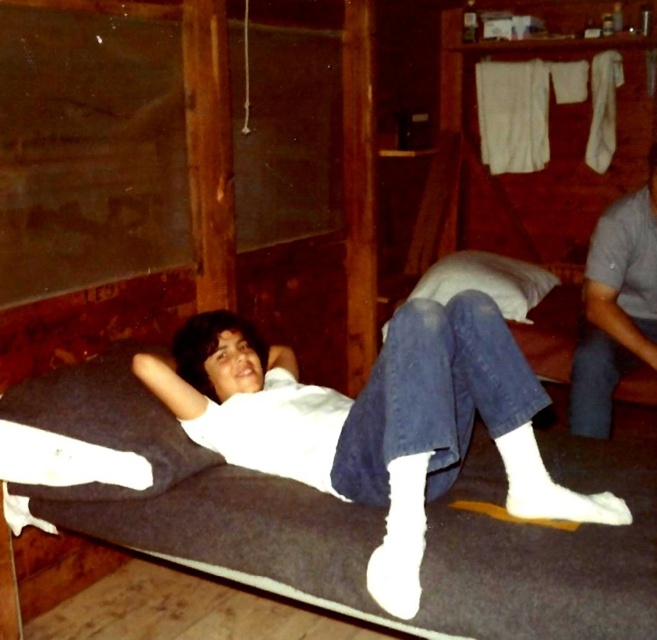
Does gray cotton shirt at right have a smaller size compared to white soft pillow at center?

Yes, gray cotton shirt at right is smaller than white soft pillow at center.

Is point (627, 280) farther from viewer compared to point (512, 289)?

That is False.

At what (x,y) coordinates should I click in order to perform the action: click on gray cotton shirt at right. Please return your answer as a coordinate pair (x, y). Looking at the image, I should click on (616, 305).

In order to click on gray cotton shirt at right in this screenshot , I will do `click(616, 305)`.

Can you confirm if dark blue fabric pillow at lower left is thinner than white soft pillow at center?

Yes.

Is point (7, 410) less distant than point (463, 268)?

That is True.

The width and height of the screenshot is (657, 640). I want to click on dark blue fabric pillow at lower left, so coord(104,420).

Between point (321, 442) and point (87, 396), which one is positioned behind?

Point (87, 396)

Who is positioned more to the right, white matte shirt at center or dark blue fabric pillow at lower left?

From the viewer's perspective, white matte shirt at center appears more on the right side.

Where is `white matte shirt at center`? The width and height of the screenshot is (657, 640). white matte shirt at center is located at coordinates (374, 420).